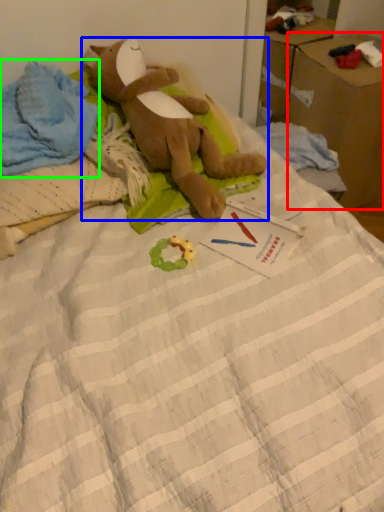
Question: Estimate the real-world distances between objects in this image. Which object is closer to cardboard box (highlighted by a red box), toy (highlighted by a blue box) or clothing (highlighted by a green box)?

Choices:
 (A) toy
 (B) clothing

Answer: (A)